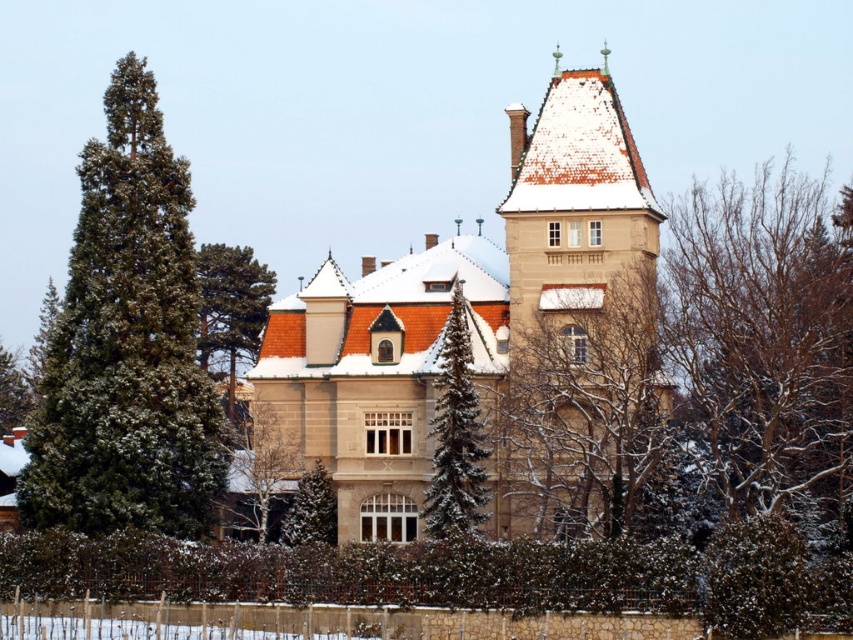
Is point (624, 262) behind point (292, 531)?

No, (624, 262) is in front of (292, 531).

Who is higher up, beige stone palace at center or snow-covered evergreen tree at center?

beige stone palace at center

Find the location of a particular element. The height and width of the screenshot is (640, 853). beige stone palace at center is located at coordinates (451, 304).

Is bare branches at right thinner than green textured pine tree at lower left?

No, bare branches at right is not thinner than green textured pine tree at lower left.

Consider the image. Is bare branches at right smaller than green textured pine tree at lower left?

Actually, bare branches at right might be larger than green textured pine tree at lower left.

Does point (788, 433) come behind point (3, 353)?

No, it is in front of (3, 353).

In order to click on bare branches at right in this screenshot , I will do `click(763, 337)`.

Can you confirm if bare branches at right is positioned below green textured pine tree at center?

No, bare branches at right is not below green textured pine tree at center.

From the picture: Can you confirm if bare branches at right is positioned above green textured pine tree at center?

Indeed, bare branches at right is positioned over green textured pine tree at center.

Is point (824, 429) in front of point (457, 435)?

No, it is behind (457, 435).

Image resolution: width=853 pixels, height=640 pixels. In order to click on bare branches at right in this screenshot , I will do `click(763, 337)`.